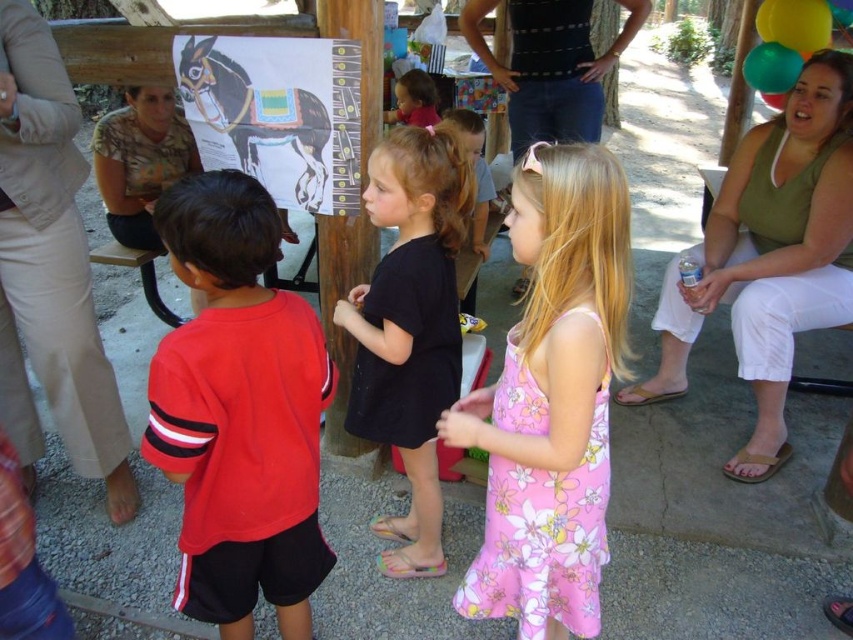
Can you confirm if yellow rubber balloon at upper right is positioned to the left of translucent green balloon at upper right?

In fact, yellow rubber balloon at upper right is to the right of translucent green balloon at upper right.

Can you confirm if yellow rubber balloon at upper right is positioned above translucent green balloon at upper right?

Correct, yellow rubber balloon at upper right is located above translucent green balloon at upper right.

What do you see at coordinates (799, 24) in the screenshot?
I see `yellow rubber balloon at upper right` at bounding box center [799, 24].

Find the location of a particular element. Image resolution: width=853 pixels, height=640 pixels. yellow rubber balloon at upper right is located at coordinates (799, 24).

Does black matte dress at center appear on the left side of translucent green balloon at upper right?

Yes, black matte dress at center is to the left of translucent green balloon at upper right.

Which is in front, point (460, 180) or point (780, 90)?

Positioned in front is point (460, 180).

Is point (374, 531) positioned after point (788, 80)?

No, it is not.

I want to click on black matte dress at center, so click(410, 326).

Measure the distance between point (769,49) and camera.

A distance of 3.06 meters exists between point (769,49) and camera.

Where is `translucent green balloon at upper right`? translucent green balloon at upper right is located at coordinates (x=770, y=67).

This screenshot has height=640, width=853. What are the coordinates of `translucent green balloon at upper right` in the screenshot? It's located at (770, 67).

Where is `translucent green balloon at upper right`? The width and height of the screenshot is (853, 640). translucent green balloon at upper right is located at coordinates (770, 67).